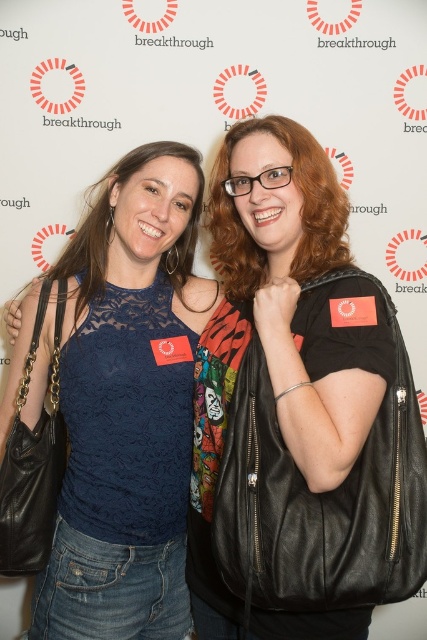
You are a photographer at the event and need to adjust the lighting to ensure both the lace fabric top at center and the black leather jacket at center are well lit. Which clothing item is closer to the left side of the frame?

The lace fabric top at center is positioned on the left side of the black leather jacket at center, so it is closer to the left side of the frame.